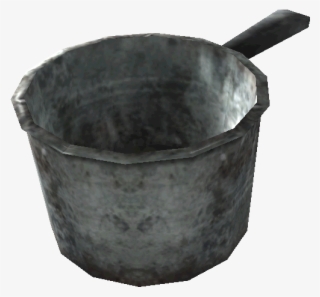
Where is `this is where the handle is joined to the cup`? The width and height of the screenshot is (320, 297). this is where the handle is joined to the cup is located at coordinates (223, 65).